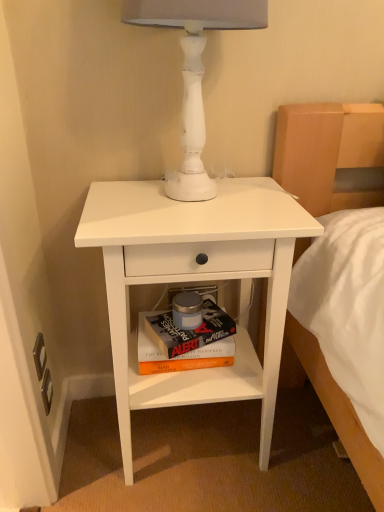
The image size is (384, 512). I want to click on vacant region in front of white matte table lamp at upper center, so click(188, 226).